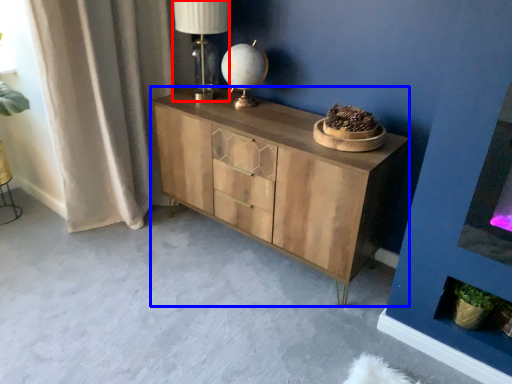
Question: Among these objects, which one is nearest to the camera, table lamp (highlighted by a red box) or chest of drawers (highlighted by a blue box)?

Choices:
 (A) table lamp
 (B) chest of drawers

Answer: (B)